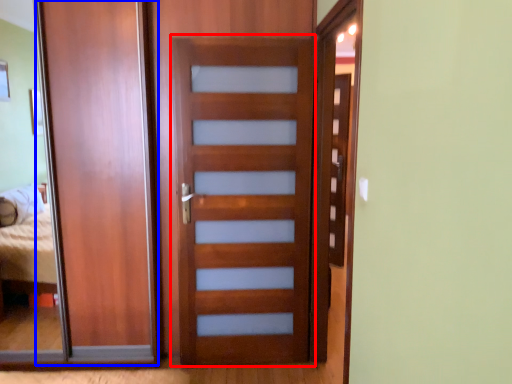
Question: Which object is further to the camera taking this photo, screen door (highlighted by a red box) or barn door (highlighted by a blue box)?

Choices:
 (A) screen door
 (B) barn door

Answer: (B)